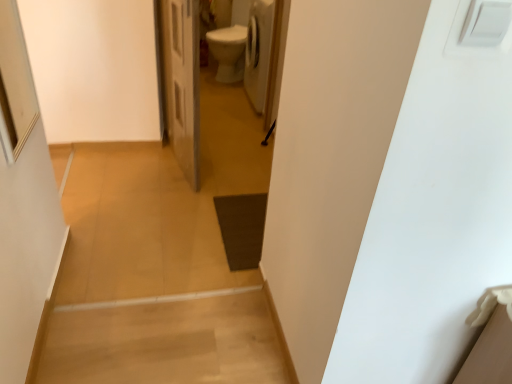
This screenshot has height=384, width=512. I want to click on white glossy door at center, so click(182, 82).

This screenshot has width=512, height=384. What do you see at coordinates (182, 82) in the screenshot?
I see `white glossy door at center` at bounding box center [182, 82].

Describe the element at coordinates (472, 46) in the screenshot. I see `white plastic switch at upper right` at that location.

In order to face white plastic switch at upper right, should I rotate leftwards or rightwards?

Turn right approximately 28.931 degrees to face it.

The width and height of the screenshot is (512, 384). I want to click on white plastic switch at upper right, so click(472, 46).

Locate an element on the screen. Image resolution: width=512 pixels, height=384 pixels. white glossy door at center is located at coordinates (182, 82).

Which object is positioned more to the left, white plastic switch at upper right or white glossy door at center?

white glossy door at center.

Is the depth of white plastic switch at upper right greater than that of white glossy door at center?

No, the depth of white plastic switch at upper right is less than that of white glossy door at center.

Is point (459, 32) behind point (182, 70)?

No.

From the image's perspective, is white plastic switch at upper right under white glossy door at center?

Yes, from the image's perspective, white plastic switch at upper right is beneath white glossy door at center.

From a real-world perspective, who is located lower, white plastic switch at upper right or white glossy door at center?

white glossy door at center.

Considering the sizes of white plastic switch at upper right and white glossy door at center in the image, is white plastic switch at upper right wider or thinner than white glossy door at center?

In the image, white plastic switch at upper right appears to be more narrow than white glossy door at center.

Is white plastic switch at upper right taller or shorter than white glossy door at center?

In the image, white plastic switch at upper right appears to be shorter than white glossy door at center.

Considering the relative sizes of white plastic switch at upper right and white glossy door at center in the image provided, is white plastic switch at upper right bigger than white glossy door at center?

Incorrect, white plastic switch at upper right is not larger than white glossy door at center.

Would you say white plastic switch at upper right is outside white glossy door at center?

That's correct, white plastic switch at upper right is outside of white glossy door at center.

Would you consider white plastic switch at upper right to be distant from white glossy door at center?

white plastic switch at upper right is far away from white glossy door at center.

Is white plastic switch at upper right turned away from white glossy door at center?

Correct, white plastic switch at upper right is looking away from white glossy door at center.

In order to click on door behind the white plastic switch at upper right in this screenshot , I will do `click(182, 82)`.

Would you say white glossy door at center is to the left or to the right of white plastic switch at upper right in the picture?

white glossy door at center is to the left of white plastic switch at upper right.

Between white glossy door at center and white plastic switch at upper right, which one is positioned in front?

white plastic switch at upper right is more forward.

Is point (169, 38) closer or farther from the camera than point (458, 45)?

Point (169, 38) is positioned farther from the camera compared to point (458, 45).

From the image's perspective, is white glossy door at center positioned above or below white plastic switch at upper right?

From the image's perspective, white glossy door at center appears above white plastic switch at upper right.

From a real-world perspective, is white glossy door at center over white plastic switch at upper right?

No, from a real-world perspective, white glossy door at center is not above white plastic switch at upper right.

Which of these two, white glossy door at center or white plastic switch at upper right, is thinner?

Thinner between the two is white plastic switch at upper right.

Can you confirm if white glossy door at center is taller than white plastic switch at upper right?

Correct, white glossy door at center is much taller as white plastic switch at upper right.

Is white glossy door at center bigger than white plastic switch at upper right?

Yes.

Can we say white glossy door at center lies outside white plastic switch at upper right?

Yes, white glossy door at center is outside of white plastic switch at upper right.

Are white glossy door at center and white plastic switch at upper right beside each other?

white glossy door at center and white plastic switch at upper right are not in contact.

Is white glossy door at center positioned with its back to white plastic switch at upper right?

No, white glossy door at center is not facing away from white plastic switch at upper right.

How different are the orientations of white glossy door at center and white plastic switch at upper right in degrees?

98.7 degrees separate the facing orientations of white glossy door at center and white plastic switch at upper right.

How distant is white glossy door at center from white plastic switch at upper right?

white glossy door at center is 1.79 meters from white plastic switch at upper right.

Find the location of a particular element. Image resolution: width=512 pixels, height=384 pixels. electric outlet that is on the right side of white glossy door at center is located at coordinates (472, 46).

Find the location of a particular element. This screenshot has width=512, height=384. door lying on the left of white plastic switch at upper right is located at coordinates (182, 82).

This screenshot has width=512, height=384. What are the coordinates of `electric outlet on the right side of white glossy door at center` in the screenshot? It's located at (472, 46).